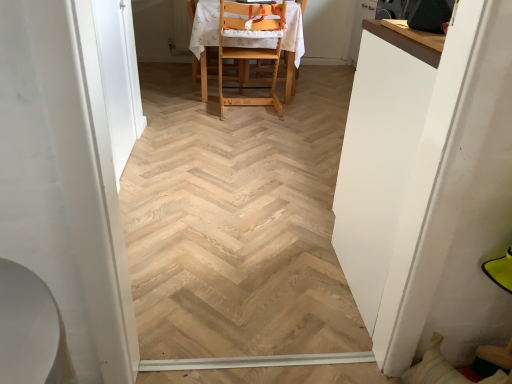
Find the location of a particular element. free spot to the right of light wood highchair at center is located at coordinates (323, 85).